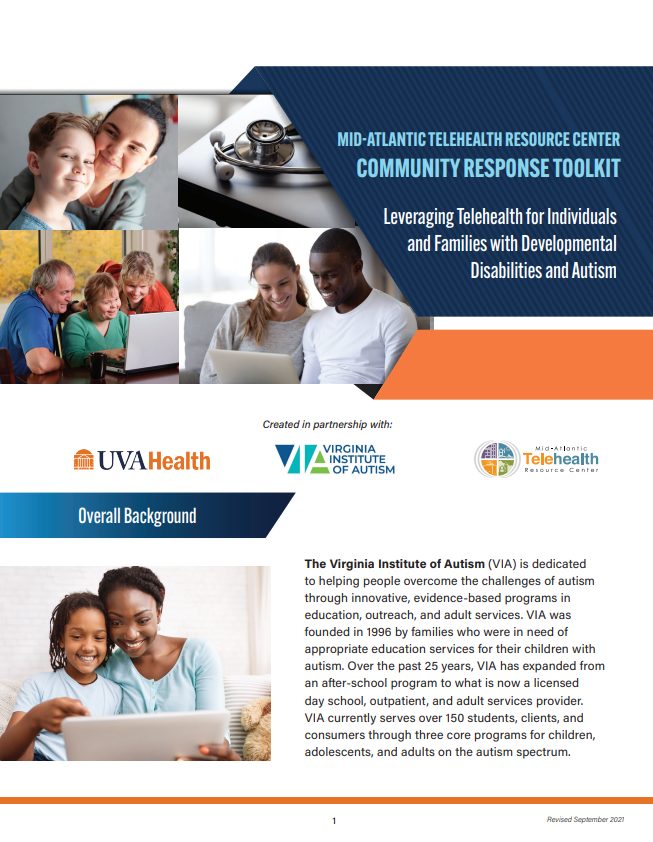
Locate an element on the screen. The image size is (653, 842). window is located at coordinates (229, 253), (95, 249).